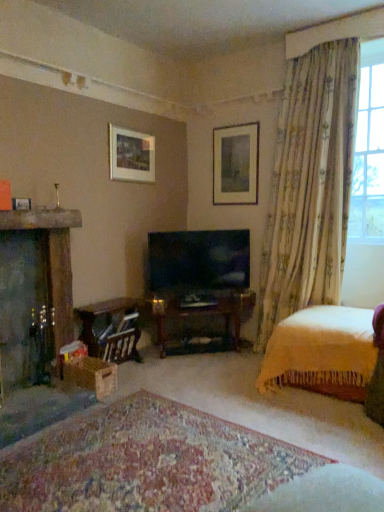
Where is `empty space that is ontop of carpeted rug at center (from a real-world perspective)`? The width and height of the screenshot is (384, 512). empty space that is ontop of carpeted rug at center (from a real-world perspective) is located at coordinates (156, 453).